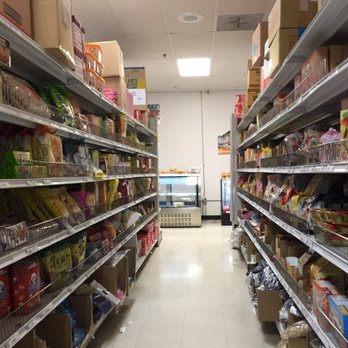
Where is `ceiling light`? ceiling light is located at coordinates (191, 70).